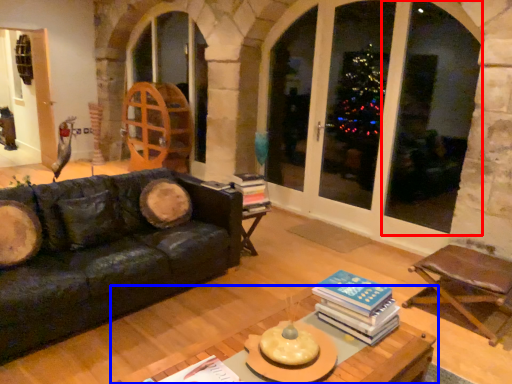
Question: Which object is closer to the camera taking this photo, window (highlighted by a red box) or table (highlighted by a blue box)?

Choices:
 (A) window
 (B) table

Answer: (B)